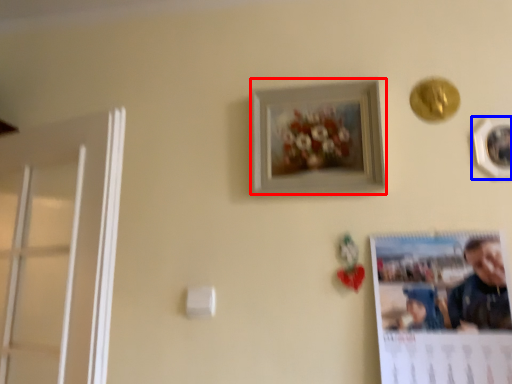
Question: Which object appears farthest to the camera in this image, picture frame (highlighted by a red box) or picture frame (highlighted by a blue box)?

Choices:
 (A) picture frame
 (B) picture frame

Answer: (A)